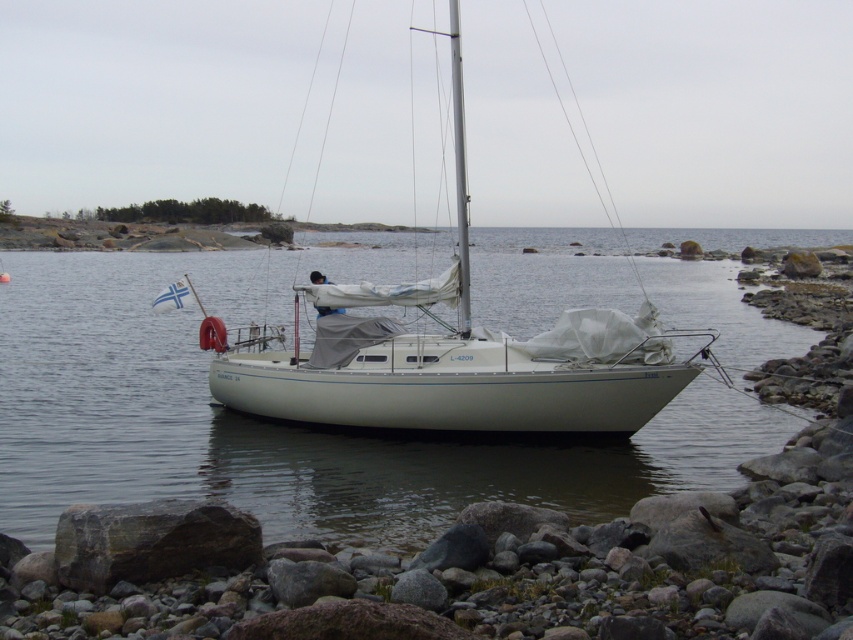
Question: Which point is closer to the camera?

Choices:
 (A) (518, 356)
 (B) (610, 483)

Answer: (B)

Question: Among these points, which one is nearest to the camera?

Choices:
 (A) (596, 365)
 (B) (494, 268)

Answer: (A)

Question: Is white water at center to the left of white matte sailboat at center from the viewer's perspective?

Choices:
 (A) no
 (B) yes

Answer: (B)

Question: Which object appears farthest from the camera in this image?

Choices:
 (A) white water at center
 (B) white matte sailboat at center

Answer: (B)

Question: Considering the relative positions of white water at center and white matte sailboat at center in the image provided, where is white water at center located with respect to white matte sailboat at center?

Choices:
 (A) above
 (B) below

Answer: (B)

Question: Does white water at center lie behind white matte sailboat at center?

Choices:
 (A) no
 (B) yes

Answer: (A)